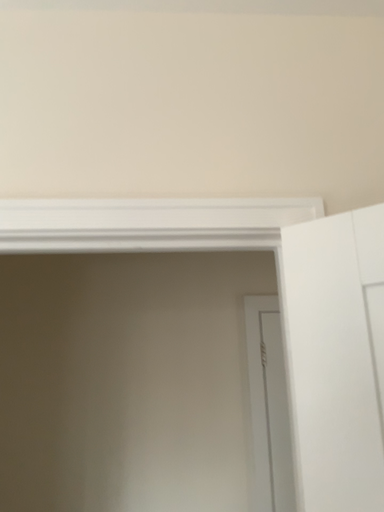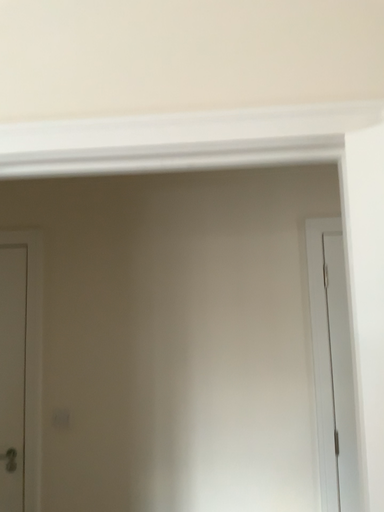
Question: How did the camera likely rotate when shooting the video?

Choices:
 (A) rotated right
 (B) rotated left

Answer: (B)